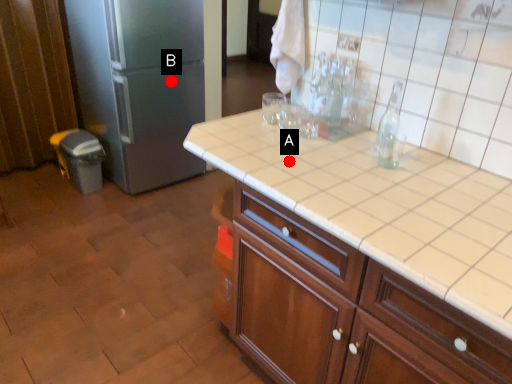
Question: Two points are circled on the image, labeled by A and B beside each circle. Among these points, which one is nearest to the camera?

Choices:
 (A) A is closer
 (B) B is closer

Answer: (A)